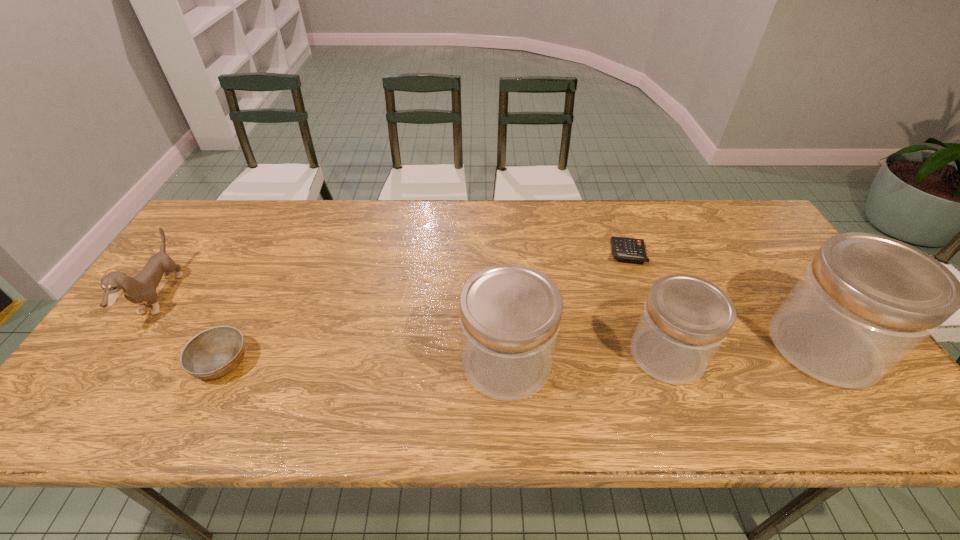
Where is `vacant area that lies between the fifth shortest object and the third tallest object`? vacant area that lies between the fifth shortest object and the third tallest object is located at coordinates (587, 359).

The height and width of the screenshot is (540, 960). What are the coordinates of `free space between the rightmost object and the second jar from left to right` in the screenshot? It's located at (745, 350).

Choose which object is the fourth nearest neighbor to the shortest object. Please provide its 2D coordinates. Your answer should be formatted as a tuple, i.e. [(x, y)], where the tuple contains the x and y coordinates of a point satisfying the conditions above.

[(213, 353)]

Identify the location of object that is the fourth closest to the second shortest object. (633, 249).

Identify which jar is located as the nearest to the shortest jar. Please provide its 2D coordinates. Your answer should be formatted as a tuple, i.e. [(x, y)], where the tuple contains the x and y coordinates of a point satisfying the conditions above.

[(865, 302)]

Identify which jar is the nearest to the puppy. Please provide its 2D coordinates. Your answer should be formatted as a tuple, i.e. [(x, y)], where the tuple contains the x and y coordinates of a point satisfying the conditions above.

[(510, 314)]

This screenshot has width=960, height=540. Find the location of `vacant area in the image that satisfies the following two spatial constraints: 1. at the face of the rightmost jar; 2. on the left side of the leftmost object`. vacant area in the image that satisfies the following two spatial constraints: 1. at the face of the rightmost jar; 2. on the left side of the leftmost object is located at coordinates (126, 346).

At what (x,y) coordinates should I click in order to perform the action: click on free space that satisfies the following two spatial constraints: 1. on the back side of the third tallest object; 2. at the face of the puppy. Please return your answer as a coordinate pair (x, y). Looking at the image, I should click on (647, 298).

The image size is (960, 540). What are the coordinates of `free location that satisfies the following two spatial constraints: 1. at the face of the leftmost object; 2. on the left side of the shortest jar` in the screenshot? It's located at (120, 354).

At what (x,y) coordinates should I click in order to perform the action: click on vacant area that satisfies the following two spatial constraints: 1. at the face of the third shortest object; 2. on the back side of the rightmost object. Please return your answer as a coordinate pair (x, y). Looking at the image, I should click on (126, 346).